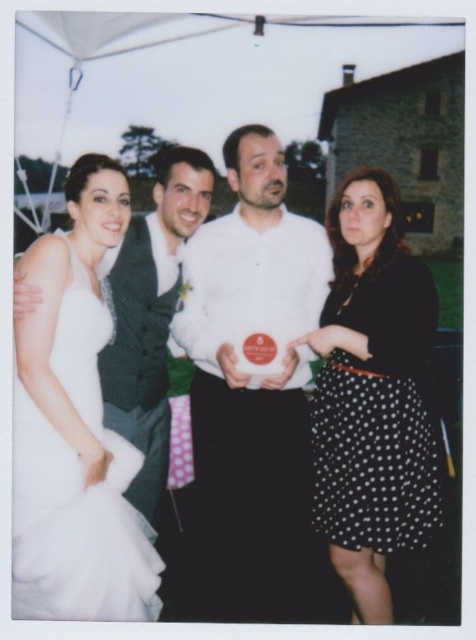
You are a photographer at a wedding and need to adjust the lighting to ensure both the white satin dress at left and the white tulle dress at left are visible. Since they are both white, how can you tell them apart based on their positions?

The white satin dress at left is located above the white tulle dress at left, so you can distinguish them by their vertical positioning in the frame.

You are a photographer setting up for a group photo. You need to ensure that the white satin dress at left and the white matte shirt at center are both visible in the frame. Given their sizes, which object requires more space horizontally to avoid being cut off?

The white satin dress at left requires more horizontal space because its width is larger than the white matte shirt at center, so it is more likely to be cut off if not given enough space.

In the scene described, there are two dresses at the left side of the frame. Which one is positioned more to the right between the white satin dress at left and the white tulle dress at left?

Result: The white satin dress at left is positioned more to the right compared to the white tulle dress at left.